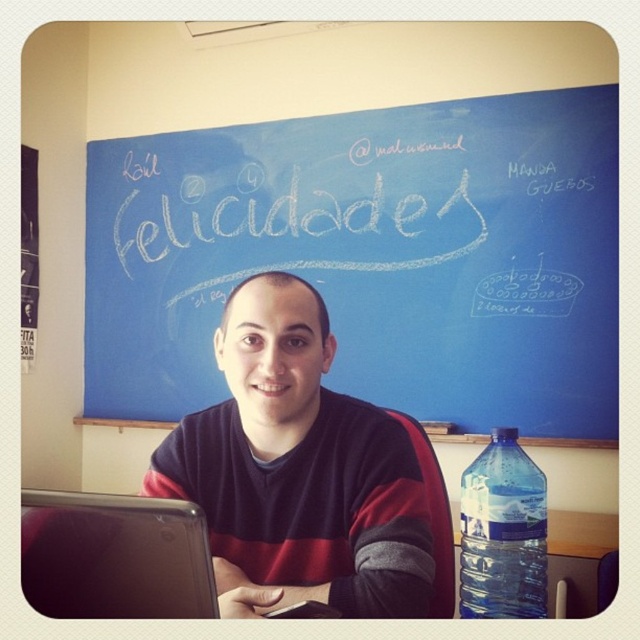
You are standing in front of the blue chalkboard and want to place a new sticker exactly where the translucent plastic water bottle at lower right is currently positioned. What are the coordinates where you should place the sticker?

The translucent plastic water bottle at lower right is located at point (x=502, y=532), so you should place the sticker at those coordinates.

You are organizing a surprise party for someone and need to place decorations. You have a silver metallic laptop at lower left and a translucent plastic water bottle at right. Where should you place the balloon so it doesn not block the laptop or the water bottle?

The silver metallic laptop at lower left is located above the translucent plastic water bottle at right. To avoid blocking either, place the balloon below the water bottle or above the laptop, ensuring it doesn not interfere with their positions.